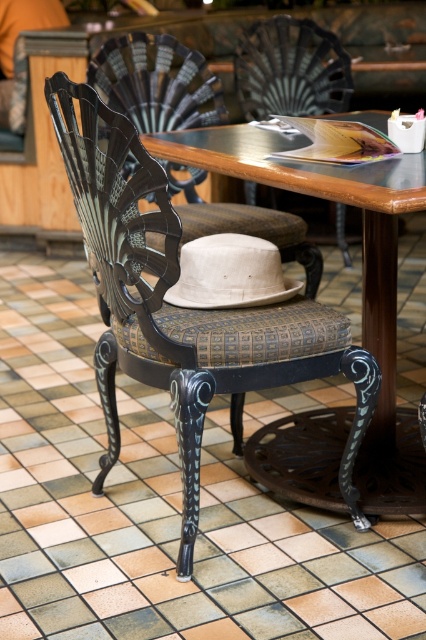
Can you confirm if matte black chair at center is wider than matte black chair at upper center?

Yes.

What do you see at coordinates (157, 83) in the screenshot? This screenshot has width=426, height=640. I see `matte black chair at center` at bounding box center [157, 83].

Identify the location of matte black chair at center. The height and width of the screenshot is (640, 426). (157, 83).

Does wooden table at center have a lesser height compared to matte black chair at center?

No.

Image resolution: width=426 pixels, height=640 pixels. What do you see at coordinates (362, 280) in the screenshot?
I see `wooden table at center` at bounding box center [362, 280].

What do you see at coordinates (362, 280) in the screenshot? This screenshot has width=426, height=640. I see `wooden table at center` at bounding box center [362, 280].

You are a GUI agent. You are given a task and a screenshot of the screen. Output one action in this format:
    pyautogui.click(x=<x>, y=<y>)
    Task: Click on the wooden table at center
    
    Given the screenshot: What is the action you would take?
    pyautogui.click(x=362, y=280)

Can you confirm if wooden table at center is wider than matte black chair at upper center?

Correct, the width of wooden table at center exceeds that of matte black chair at upper center.

Is wooden table at center above matte black chair at upper center?

No, wooden table at center is not above matte black chair at upper center.

Describe the element at coordinates (362, 280) in the screenshot. I see `wooden table at center` at that location.

You are a GUI agent. You are given a task and a screenshot of the screen. Output one action in this format:
    pyautogui.click(x=<x>, y=<y>)
    Task: Click on the wooden table at center
    
    Given the screenshot: What is the action you would take?
    pyautogui.click(x=362, y=280)